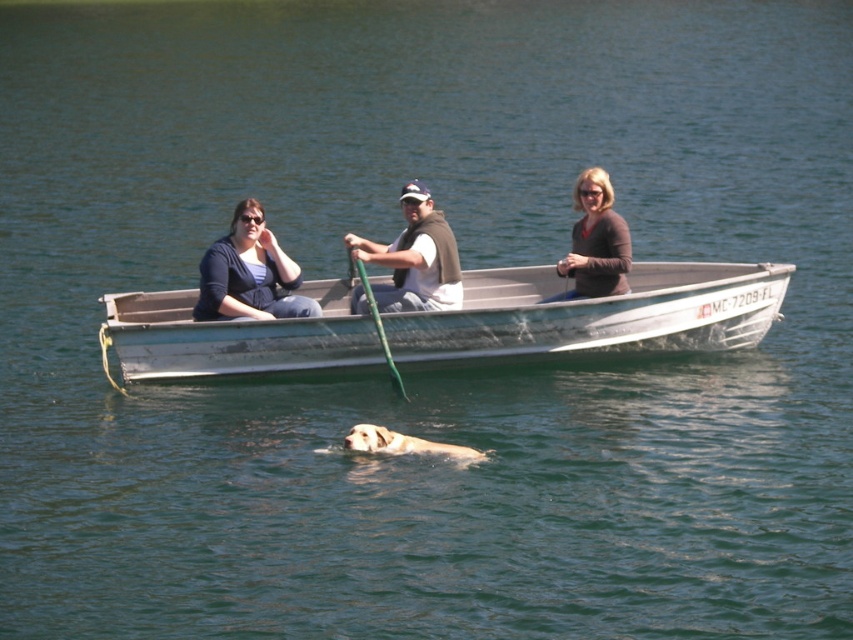
Between matte black sweater at left and matte brown sweater at center, which one appears on the right side from the viewer's perspective?

From the viewer's perspective, matte brown sweater at center appears more on the right side.

Consider the image. How far apart are matte black sweater at left and matte brown sweater at center?

A distance of 3.54 meters exists between matte black sweater at left and matte brown sweater at center.

Between point (262, 285) and point (592, 276), which one is positioned in front?

Positioned in front is point (592, 276).

Locate an element on the screen. The width and height of the screenshot is (853, 640). matte black sweater at left is located at coordinates (248, 273).

Consider the image. Is metallic gray boat at center bigger than matte brown sweater at center?

No.

Is metallic gray boat at center thinner than matte brown sweater at center?

Yes, metallic gray boat at center is thinner than matte brown sweater at center.

Is point (502, 305) positioned in front of point (595, 182)?

No, it is behind (595, 182).

This screenshot has width=853, height=640. What are the coordinates of `metallic gray boat at center` in the screenshot? It's located at (593, 316).

Which is below, metallic gray boat at center or matte black sweater at left?

metallic gray boat at center

Is point (115, 342) in front of point (283, 316)?

That is True.

This screenshot has width=853, height=640. I want to click on metallic gray boat at center, so click(593, 316).